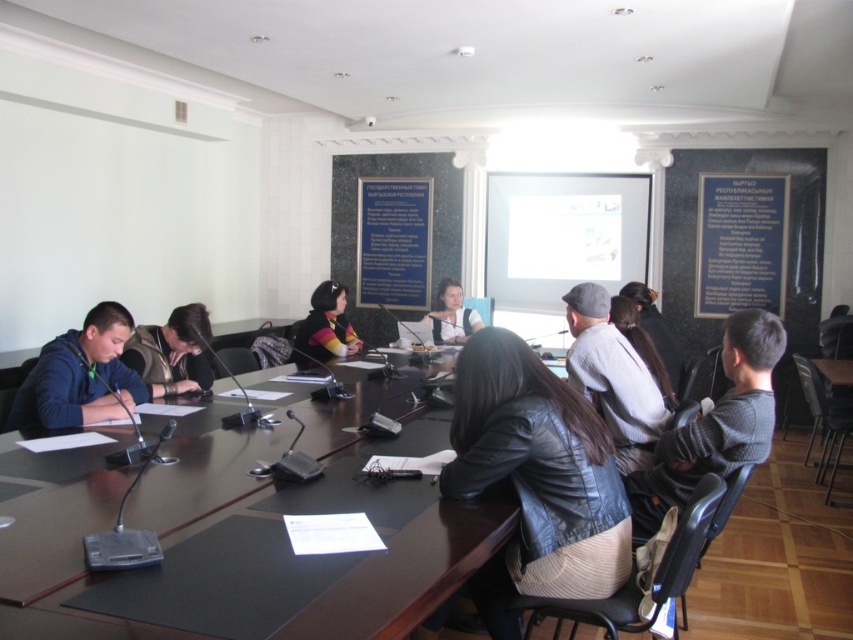
From the picture: You are a photographer setting up for a group photo. You have to position two items in the scene for a backdrop. The items are the dark brown leather jacket at left and the matte black shirt at center. Which item should you place closer to the camera to ensure both appear the same size in the photo?

The dark brown leather jacket at left is smaller than the matte black shirt at center. To make them appear the same size in the photo, you should place the dark brown leather jacket at left closer to the camera than the matte black shirt at center.